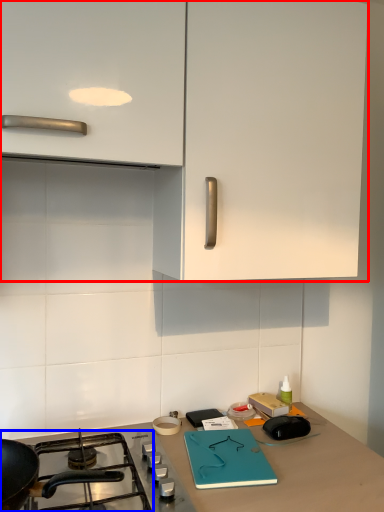
Question: Which object appears farthest to the camera in this image, cabinetry (highlighted by a red box) or gas stove (highlighted by a blue box)?

Choices:
 (A) cabinetry
 (B) gas stove

Answer: (A)